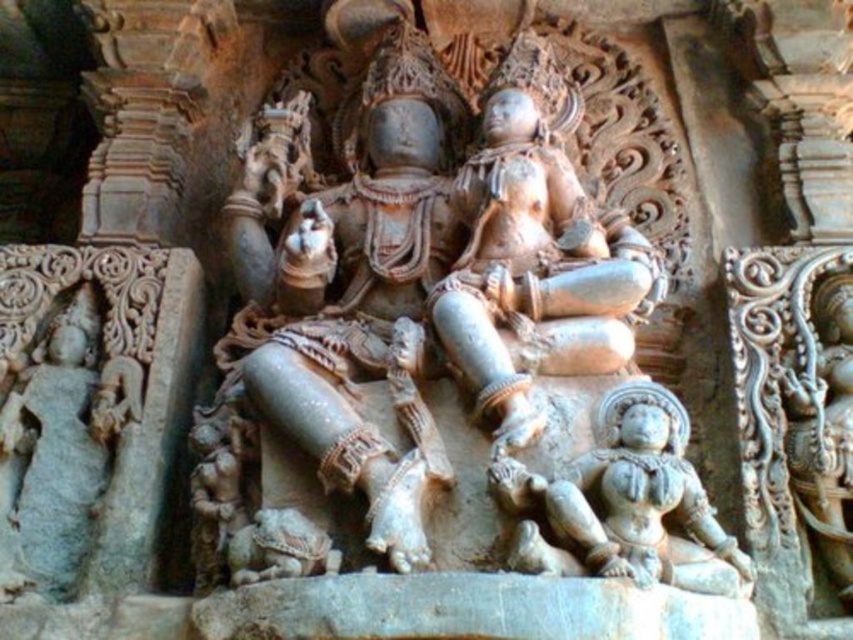
You are an art conservator examining the intricate stone relief. You notice the smooth stone statue at center and the gray stone statue at left. Which statue has a greater height?

The smooth stone statue at center is much taller than the gray stone statue at left according to the description.

You are an art conservator examining the intricate stone relief. You need to determine if the gray stone statue at center can fit into a storage space that is narrower than the gray stone statue at left. Can it fit based on their widths?

The gray stone statue at center has a width less than the gray stone statue at left, so it can fit into a storage space narrower than the left statue.

Looking at the stone relief, you notice two statues. The smooth stone statue at center and the gray stone statue at left. Which one is larger in size?

The smooth stone statue at center is bigger than the gray stone statue at left, so the smooth stone statue at center is the larger one.